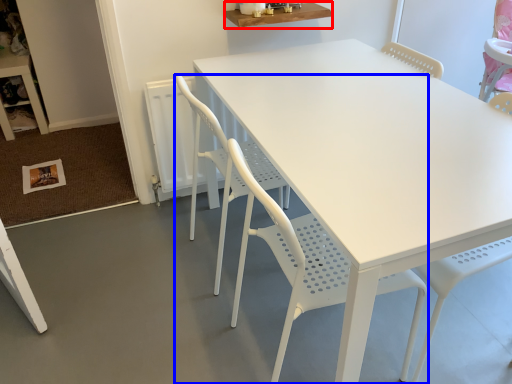
Question: Which object is further to the camera taking this photo, table (highlighted by a red box) or chair (highlighted by a blue box)?

Choices:
 (A) table
 (B) chair

Answer: (A)